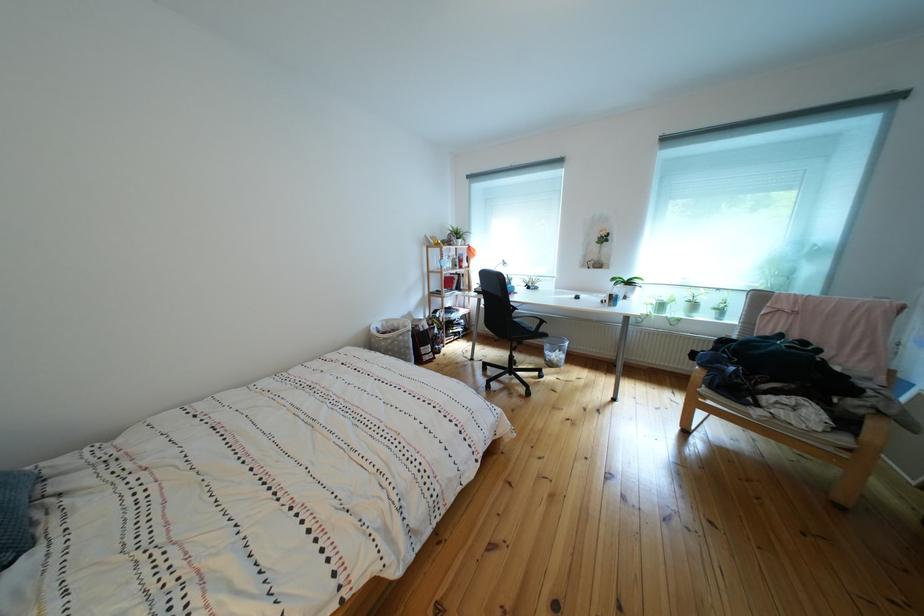
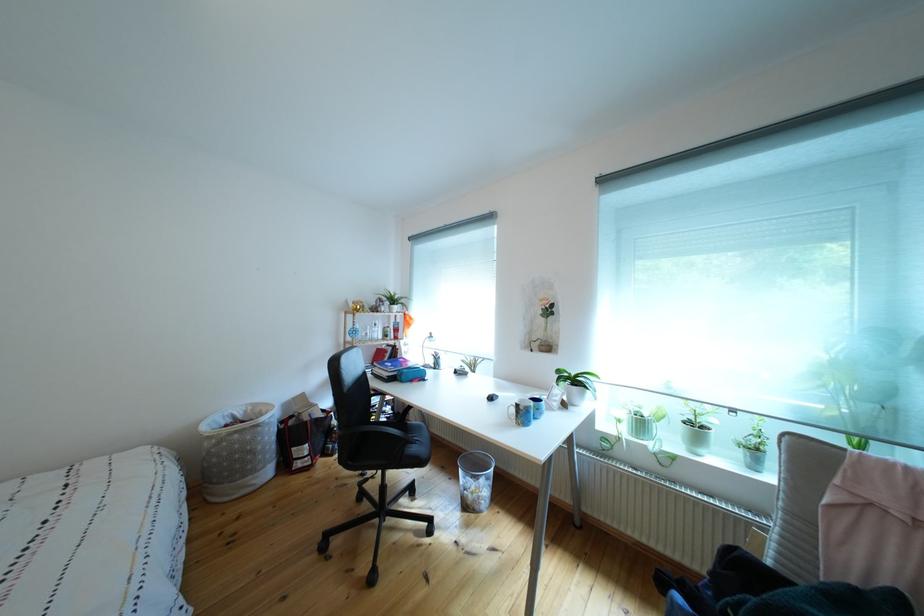
In the second image, find the point that corresponds to point 625,305 in the first image.

(533, 419)